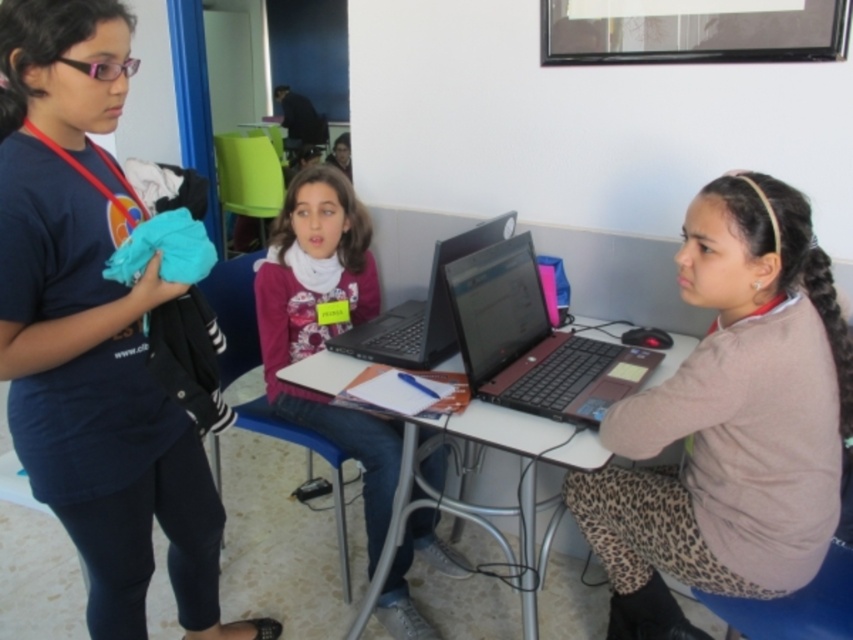
In the classroom scene, there is a matte black laptop at center and a matte plastic table at center. Which object takes up more space in the image?

The matte plastic table at center occupies more space than the matte black laptop at center.

Where is the matte blue shirt at left located in the image?

The matte blue shirt at left is located at point 0.522 on the x axis and 0.110 on the y axis.

You are a student entering the classroom and need to sit down. There is a leopard print sweater at center and a matte plastic table at center. Which object should you move to access the seat?

The leopard print sweater at center is to the right of the matte plastic table at center, so you should move the leopard print sweater at center to access the seat.